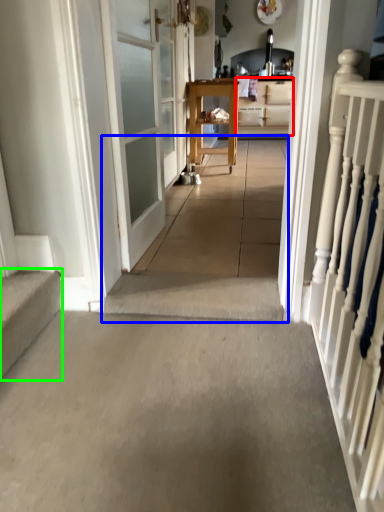
Question: Considering the real-world distances, which object is farthest from cabinetry (highlighted by a red box)? path (highlighted by a blue box) or stairs (highlighted by a green box)?

Choices:
 (A) path
 (B) stairs

Answer: (B)